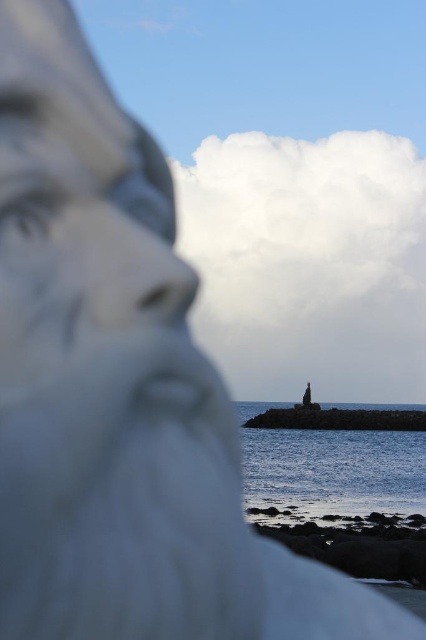
Is blue water at lower center to the left of smooth stone statue at center from the viewer's perspective?

No, blue water at lower center is not to the left of smooth stone statue at center.

Which is behind, point (363, 502) or point (307, 392)?

The point (307, 392) is more distant.

This screenshot has width=426, height=640. Find the location of `blue water at lower center`. blue water at lower center is located at coordinates [333, 472].

Between point (298, 458) and point (328, 420), which one is positioned behind?

The point (328, 420) is behind.

Is point (259, 444) closer to viewer compared to point (313, 413)?

Yes, it is.

You are a GUI agent. You are given a task and a screenshot of the screen. Output one action in this format:
    pyautogui.click(x=<x>, y=<y>)
    Task: Click on the blue water at lower center
    
    Given the screenshot: What is the action you would take?
    pyautogui.click(x=333, y=472)

Who is positioned more to the right, smooth concrete pier at center or smooth stone statue at center?

smooth concrete pier at center

Based on the photo, does smooth concrete pier at center have a smaller size compared to smooth stone statue at center?

No.

Describe the element at coordinates (339, 419) in the screenshot. Image resolution: width=426 pixels, height=640 pixels. I see `smooth concrete pier at center` at that location.

Locate an element on the screen. Image resolution: width=426 pixels, height=640 pixels. smooth concrete pier at center is located at coordinates (339, 419).